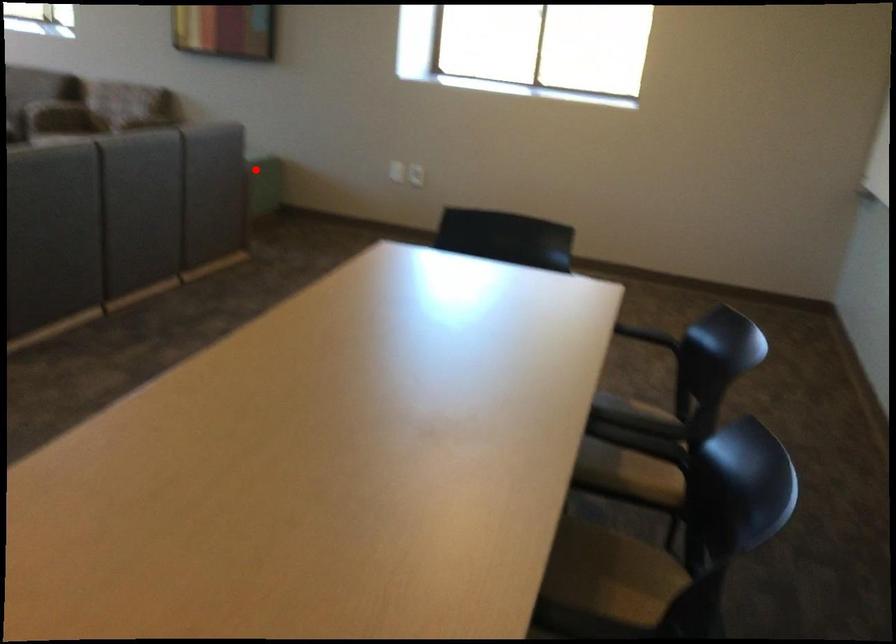
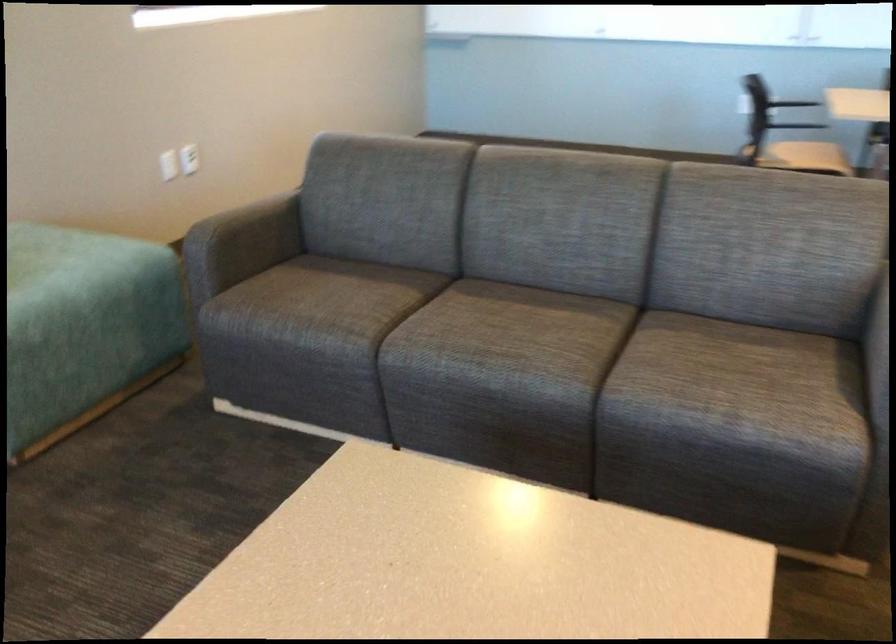
Question: I am providing you with two images of the same scene from different viewpoints. Image1 has a red point marked. In image2, the corresponding 3D location appears at what relative position? Reply with the corresponding letter.

Choices:
 (A) Closer
 (B) Farther

Answer: (A)